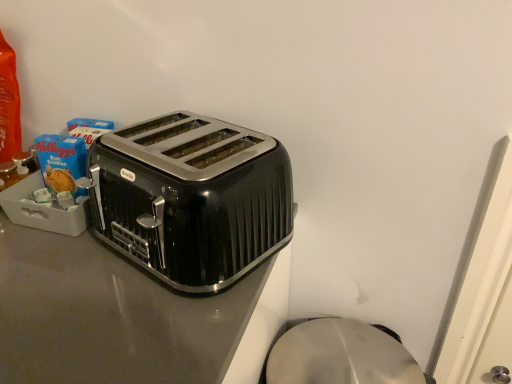
Question: Is black glossy toaster at center wider or thinner than black metallic toaster at center?

Choices:
 (A) wide
 (B) thin

Answer: (A)

Question: Does point (113, 382) appear closer or farther from the camera than point (256, 233)?

Choices:
 (A) closer
 (B) farther

Answer: (A)

Question: From the image's perspective, relative to black metallic toaster at center, is black glossy toaster at center above or below?

Choices:
 (A) below
 (B) above

Answer: (A)

Question: From the image's perspective, is black metallic toaster at center above or below black glossy toaster at center?

Choices:
 (A) above
 (B) below

Answer: (A)

Question: Is black metallic toaster at center in front of or behind black glossy toaster at center in the image?

Choices:
 (A) behind
 (B) front

Answer: (A)

Question: Looking at the image, does black metallic toaster at center seem bigger or smaller compared to black glossy toaster at center?

Choices:
 (A) small
 (B) big

Answer: (A)

Question: Is black metallic toaster at center wider or thinner than black glossy toaster at center?

Choices:
 (A) thin
 (B) wide

Answer: (A)